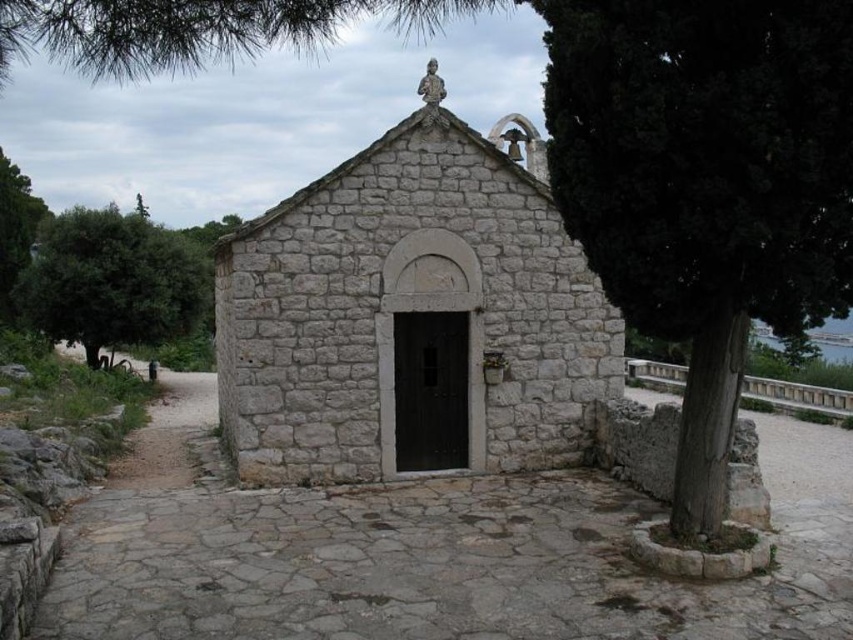
Based on the photo, you are standing at the entrance of the chapel and want to walk to the gray stone path at center. In which direction should you move relative to the chapel entrance?

Since the gray stone path at center is located at coordinates approximately 0.863 along the x axis and 0.501 along the y axis, you should move forward from the chapel entrance to reach it.

You are standing in front of the gray stone church at center and want to walk towards the gray stone path at center. Which direction should you face to move towards it?

The gray stone path at center is below the gray stone church at center, so you should face downward to move towards it.